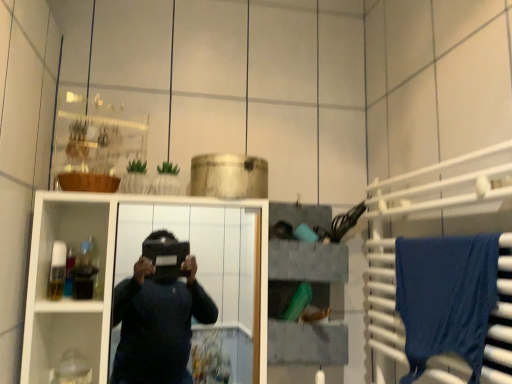
Question: Does blue fabric at right have a larger size compared to gray fabric storage at upper center?

Choices:
 (A) no
 (B) yes

Answer: (B)

Question: From a real-world perspective, is blue fabric at right on gray fabric storage at upper center?

Choices:
 (A) no
 (B) yes

Answer: (A)

Question: Is blue fabric at right aimed at gray fabric storage at upper center?

Choices:
 (A) yes
 (B) no

Answer: (A)

Question: Are blue fabric at right and gray fabric storage at upper center making contact?

Choices:
 (A) no
 (B) yes

Answer: (A)

Question: Is blue fabric at right further to the viewer compared to gray fabric storage at upper center?

Choices:
 (A) no
 (B) yes

Answer: (A)

Question: Looking at the image, does white glossy cabinet at center seem bigger or smaller compared to blue fabric at right?

Choices:
 (A) big
 (B) small

Answer: (A)

Question: Is white glossy cabinet at center in front of or behind blue fabric at right in the image?

Choices:
 (A) front
 (B) behind

Answer: (B)

Question: Considering the relative positions of white glossy cabinet at center and blue fabric at right in the image provided, is white glossy cabinet at center to the left or to the right of blue fabric at right?

Choices:
 (A) right
 (B) left

Answer: (B)

Question: Does point (110, 231) appear closer or farther from the camera than point (394, 206)?

Choices:
 (A) farther
 (B) closer

Answer: (B)

Question: From the image's perspective, is gray fabric storage at upper center positioned above or below white glossy cabinet at center?

Choices:
 (A) above
 (B) below

Answer: (A)

Question: Is gray fabric storage at upper center inside the boundaries of white glossy cabinet at center, or outside?

Choices:
 (A) inside
 (B) outside

Answer: (B)

Question: Is point (271, 319) positioned closer to the camera than point (59, 235)?

Choices:
 (A) closer
 (B) farther

Answer: (A)

Question: From a real-world perspective, is gray fabric storage at upper center physically located above or below white glossy cabinet at center?

Choices:
 (A) above
 (B) below

Answer: (A)

Question: Considering the positions of point (387, 190) and point (468, 326), is point (387, 190) closer or farther from the camera than point (468, 326)?

Choices:
 (A) closer
 (B) farther

Answer: (B)

Question: Considering their positions, is blue fabric at right located in front of or behind blue fabric towel at right?

Choices:
 (A) behind
 (B) front

Answer: (B)